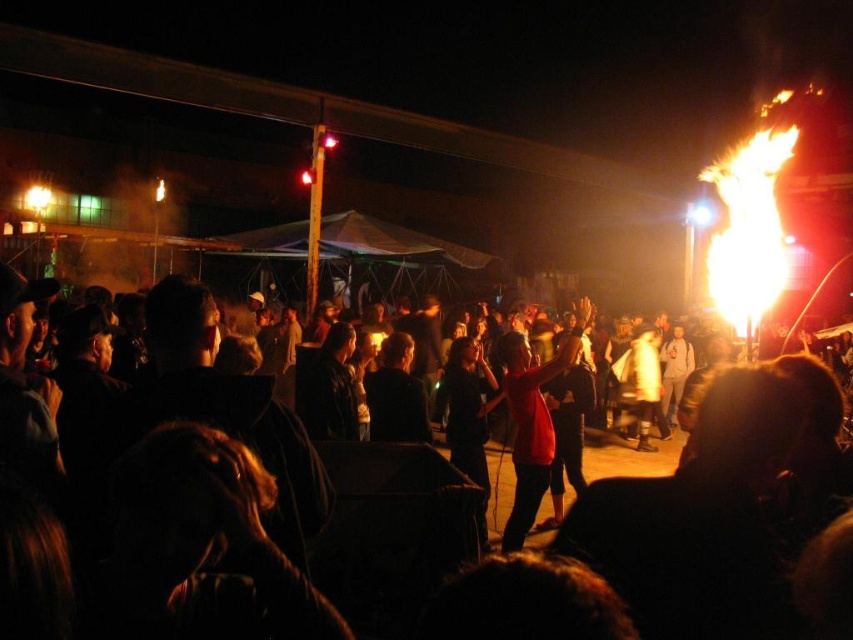
Can you confirm if matte red shirt at center is positioned above red matte shirt at center?

Indeed, matte red shirt at center is positioned over red matte shirt at center.

Which is more to the left, matte red shirt at center or red matte shirt at center?

Positioned to the left is matte red shirt at center.

What do you see at coordinates (653, 545) in the screenshot? Image resolution: width=853 pixels, height=640 pixels. I see `matte red shirt at center` at bounding box center [653, 545].

I want to click on matte red shirt at center, so click(653, 545).